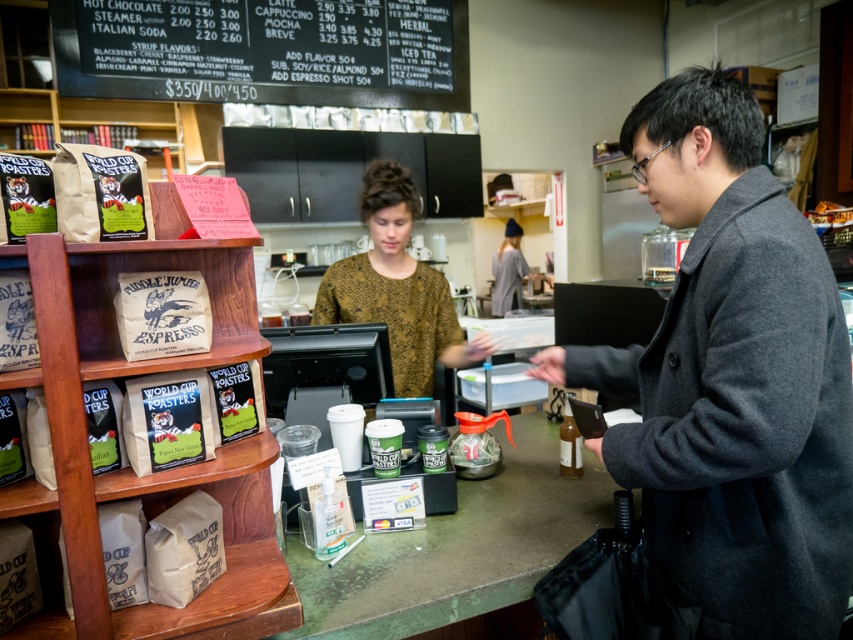
Question: Does green matte counter at center have a lesser width compared to brown textured blouse at center?

Choices:
 (A) no
 (B) yes

Answer: (A)

Question: Does dark gray wool coat at center right appear over green matte counter at center?

Choices:
 (A) no
 (B) yes

Answer: (B)

Question: Based on their relative distances, which object is nearer to the brown textured blouse at center?

Choices:
 (A) dark gray wool coat at center right
 (B) blackboard menu at upper center
 (C) green matte counter at center

Answer: (C)

Question: Can you confirm if dark gray wool coat at center right is smaller than green matte counter at center?

Choices:
 (A) no
 (B) yes

Answer: (A)

Question: Which of the following is the closest to the observer?

Choices:
 (A) blackboard menu at upper center
 (B) green matte counter at center
 (C) brown textured blouse at center

Answer: (B)

Question: Which object appears farthest from the camera in this image?

Choices:
 (A) green matte counter at center
 (B) dark gray wool coat at center right
 (C) blackboard menu at upper center
 (D) brown textured blouse at center

Answer: (C)